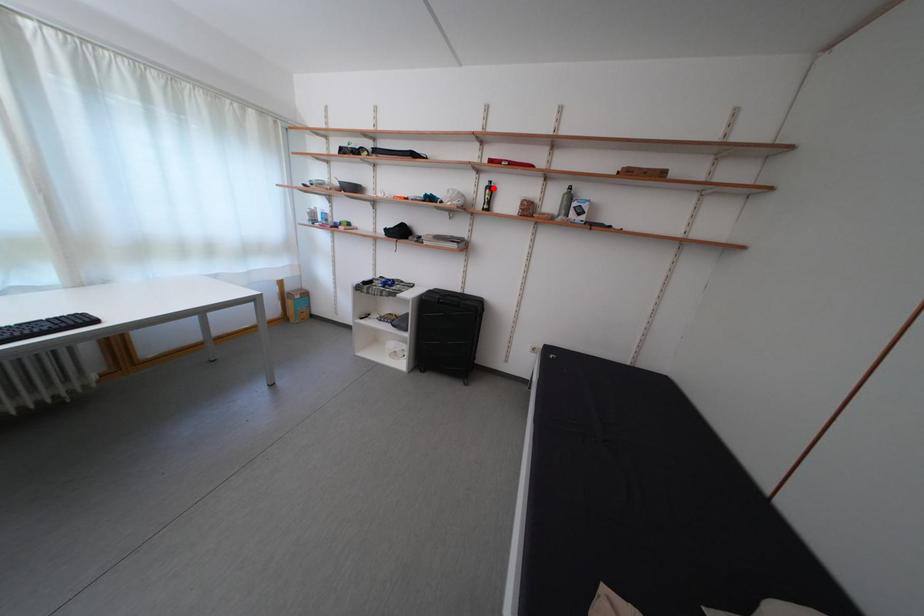
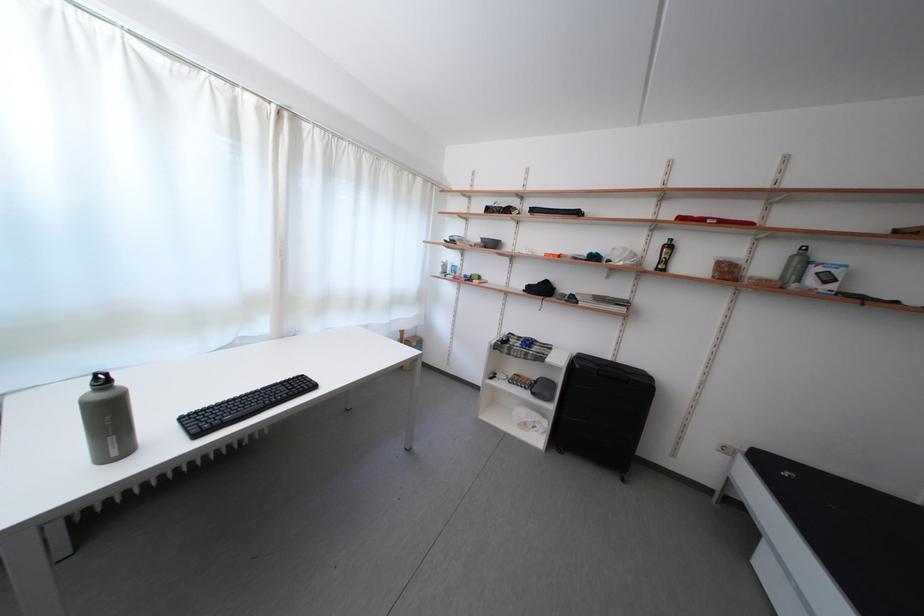
Where in the second image is the point corresponding to the highlighted location from the first image?

(669, 246)